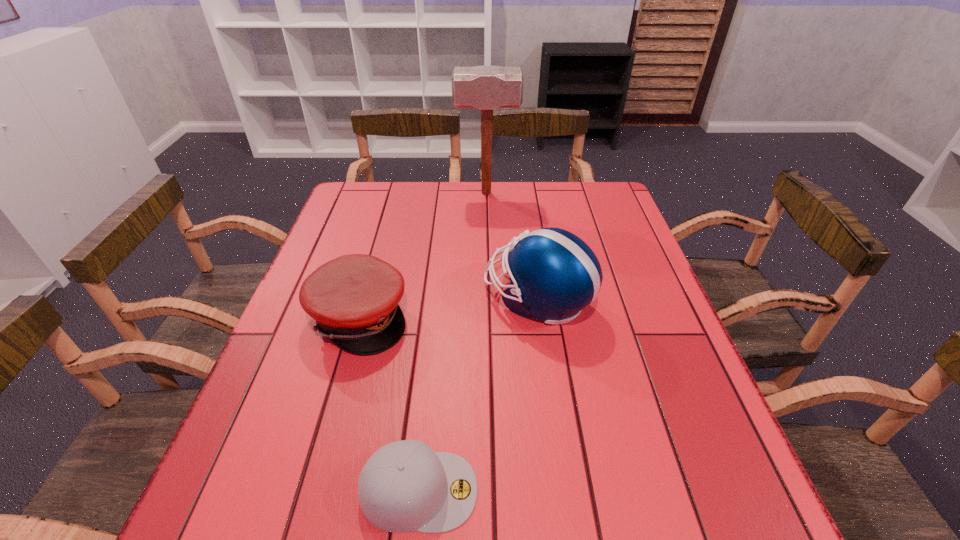
Where is `free point at the right edge`? This screenshot has width=960, height=540. free point at the right edge is located at coordinates (699, 463).

Where is `free space at the far left corner of the desktop`? free space at the far left corner of the desktop is located at coordinates (335, 219).

Where is `free location at the near left corner of the desktop`? free location at the near left corner of the desktop is located at coordinates coord(232,508).

In the image, there is a desktop. Identify the location of vacant space at the far right corner. (580, 191).

Locate an element on the screen. free point between the nearer cap and the football helmet is located at coordinates (478, 394).

Find the location of a particular element. unoccupied position between the second tallest object and the third tallest object is located at coordinates (448, 308).

Locate an element on the screen. Image resolution: width=960 pixels, height=540 pixels. vacant space in between the second tallest object and the farther cap is located at coordinates (448, 308).

Image resolution: width=960 pixels, height=540 pixels. What are the coordinates of `vacant area between the farthest object and the nearer cap` in the screenshot? It's located at (453, 341).

Locate an element on the screen. Image resolution: width=960 pixels, height=540 pixels. free spot between the farthest object and the taller cap is located at coordinates (422, 255).

This screenshot has width=960, height=540. Identify the location of vacant area that lies between the football helmet and the farther cap. (448, 308).